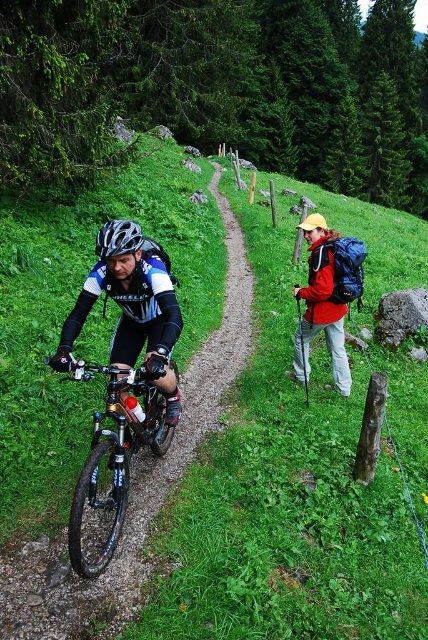
Between shiny black bicycle at center and matte black jacket at right, which one has more height?

matte black jacket at right is taller.

Is point (154, 344) positioned behind point (308, 275)?

No, it is in front of (308, 275).

Which is in front, point (148, 314) or point (320, 307)?

Positioned in front is point (148, 314).

Where is `shiny black bicycle at center`? shiny black bicycle at center is located at coordinates (131, 307).

Where is `shiny black bicycle at center`? Image resolution: width=428 pixels, height=640 pixels. shiny black bicycle at center is located at coordinates (131, 307).

Does shiny black bicycle at center appear over matte black helmet at left?

Actually, shiny black bicycle at center is below matte black helmet at left.

At what (x,y) coordinates should I click in order to perform the action: click on shiny black bicycle at center. Please return your answer as a coordinate pair (x, y). Looking at the image, I should click on [x=131, y=307].

Where is `shiny black bicycle at center`? This screenshot has height=640, width=428. shiny black bicycle at center is located at coordinates (131, 307).

What do you see at coordinates (112, 461) in the screenshot? I see `shiny metallic bicycle at left` at bounding box center [112, 461].

Can you confirm if shiny metallic bicycle at left is taller than matte black jacket at right?

No.

Between point (74, 545) and point (300, 358), which one is positioned behind?

The point (300, 358) is behind.

This screenshot has height=640, width=428. I want to click on shiny metallic bicycle at left, so click(x=112, y=461).